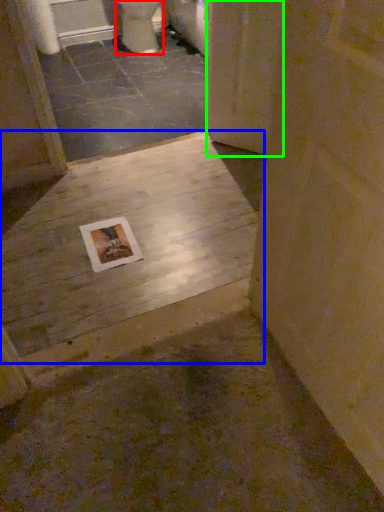
Question: Which object is the closest to the toilet (highlighted by a red box)? Choose among these: concrete (highlighted by a blue box) or screen door (highlighted by a green box).

Choices:
 (A) concrete
 (B) screen door

Answer: (B)